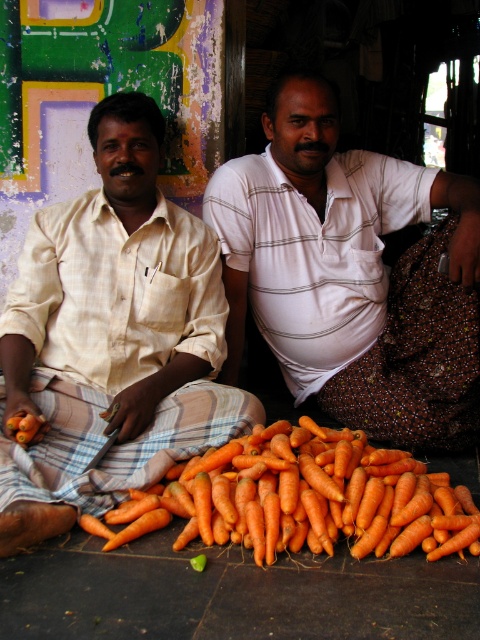
Question: Does orange matte carrots at lower center have a smaller size compared to brown textured cloth at lower right?

Choices:
 (A) yes
 (B) no

Answer: (A)

Question: In this image, where is white striped shirt at center located relative to brown textured cloth at lower right?

Choices:
 (A) above
 (B) below

Answer: (A)

Question: Considering the relative positions of orange matte carrots at lower center and brown textured cloth at lower right in the image provided, where is orange matte carrots at lower center located with respect to brown textured cloth at lower right?

Choices:
 (A) below
 (B) above

Answer: (A)

Question: Among these objects, which one is farthest from the camera?

Choices:
 (A) brown textured cloth at lower right
 (B) orange matte carrots at lower center

Answer: (A)

Question: Which of the following is the closest to the observer?

Choices:
 (A) (103, 305)
 (B) (456, 328)
 (C) (389, 497)

Answer: (C)

Question: Among these objects, which one is farthest from the camera?

Choices:
 (A) orange matte carrots at lower center
 (B) white striped shirt at center
 (C) brown textured cloth at lower right
 (D) light beige fabric shirt at left

Answer: (C)